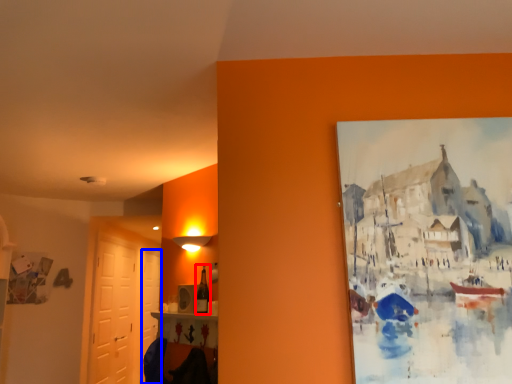
Question: Which point is further to the camera, bottle (highlighted by a red box) or door (highlighted by a blue box)?

Choices:
 (A) bottle
 (B) door

Answer: (B)